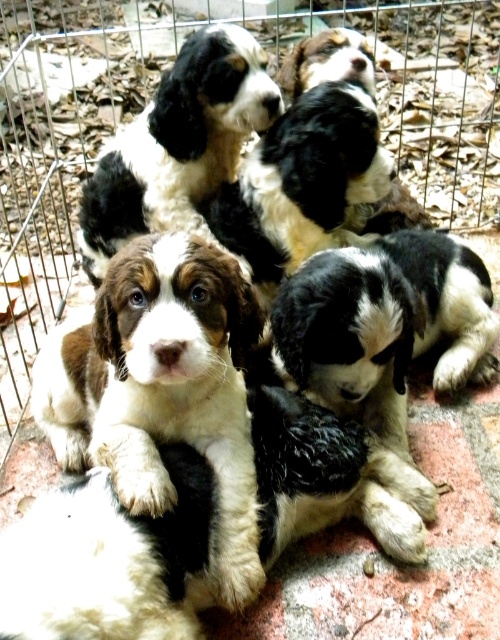
Question: Which of these objects is positioned farthest from the soft fur puppy at center?

Choices:
 (A) metal wire fence at center
 (B) black and white fur at center

Answer: (A)

Question: Which of these objects is positioned closest to the black and white fur at center?

Choices:
 (A) soft fur puppy at center
 (B) metal wire fence at center

Answer: (A)

Question: Which object is closer to the camera taking this photo?

Choices:
 (A) soft fur puppy at center
 (B) black and white fur at center
 (C) metal wire fence at center

Answer: (A)

Question: Is metal wire fence at center smaller than black and white fur at center?

Choices:
 (A) yes
 (B) no

Answer: (B)

Question: Is metal wire fence at center smaller than soft fur puppy at center?

Choices:
 (A) yes
 (B) no

Answer: (B)

Question: Can you confirm if soft fur puppy at center is thinner than black and white fur at center?

Choices:
 (A) yes
 (B) no

Answer: (A)